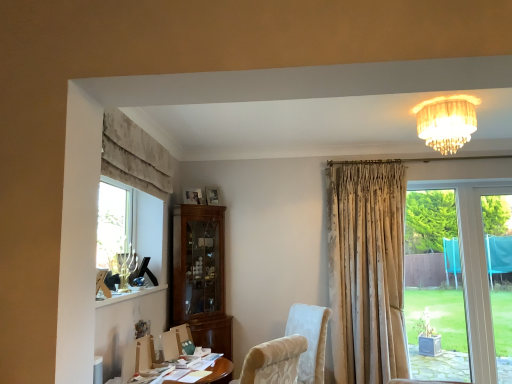
Where is `golden crystal chandelier at upper right`? golden crystal chandelier at upper right is located at coordinates (446, 122).

Describe the element at coordinates (446, 122) in the screenshot. I see `golden crystal chandelier at upper right` at that location.

The image size is (512, 384). What are the coordinates of `golden crystal chandelier at upper right` in the screenshot? It's located at (446, 122).